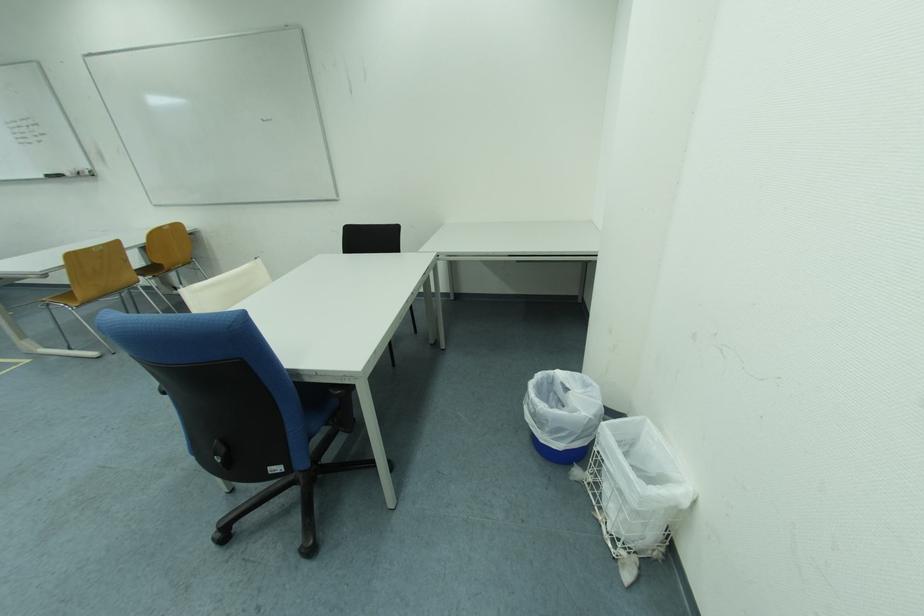
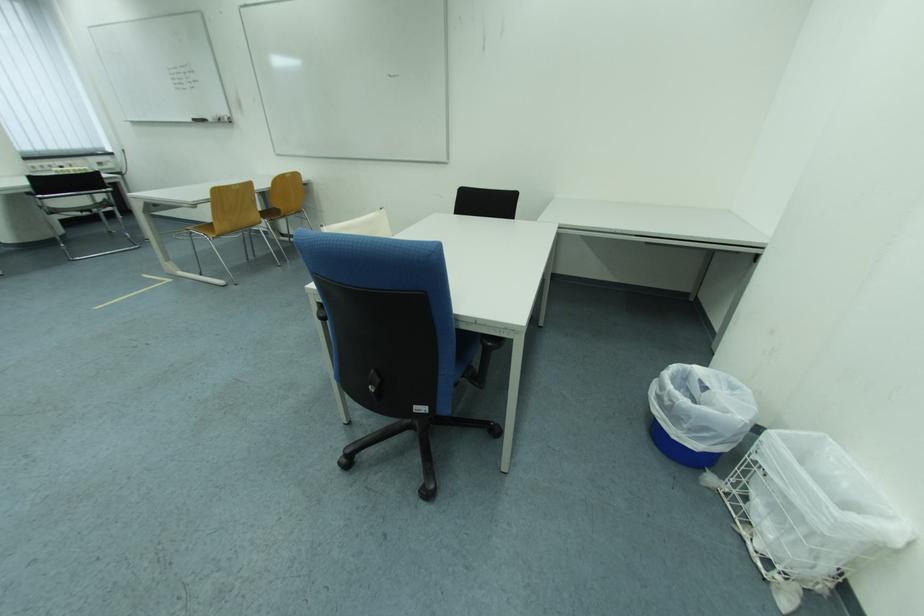
Where in the second image is the point corresponding to [339,392] from the first image?

(493, 344)